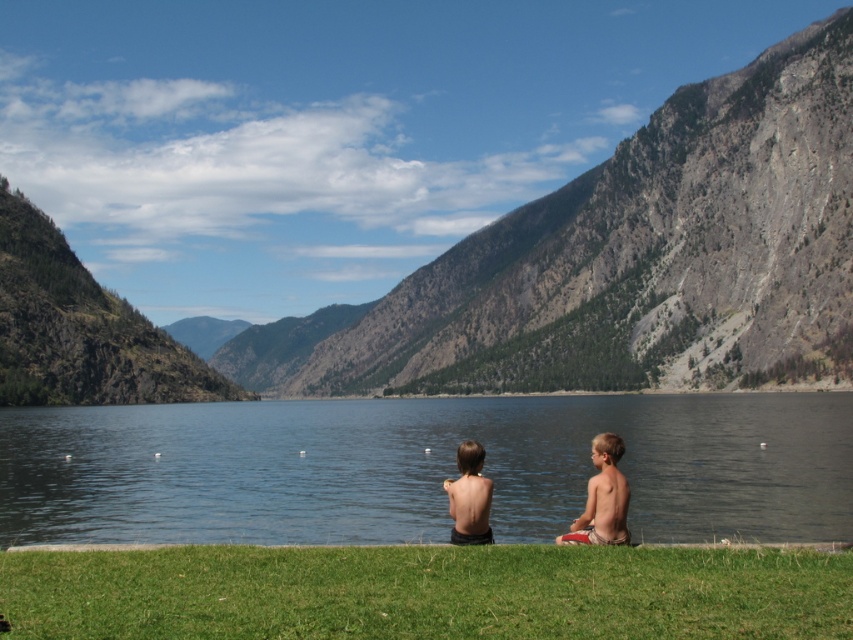
You are a photographer trying to capture both the green rocky mountain at center and the smooth skin child at center in the same frame. Based on their sizes, which object should you focus on first to ensure both are in the frame?

The green rocky mountain at center is larger than the smooth skin child at center, so you should focus on the green rocky mountain at center first to ensure both are in the frame.